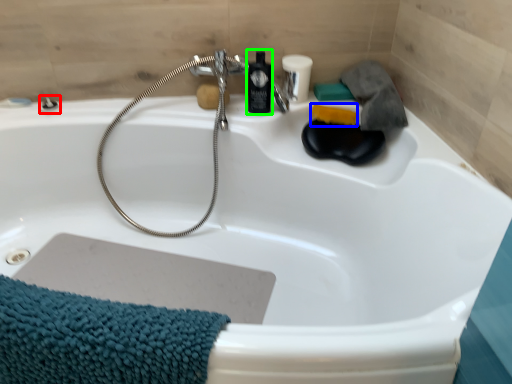
Question: Based on their relative distances, which object is farther from shower (highlighted by a red box)? Choose from soap (highlighted by a blue box) and mouthwash (highlighted by a green box).

Choices:
 (A) soap
 (B) mouthwash

Answer: (A)